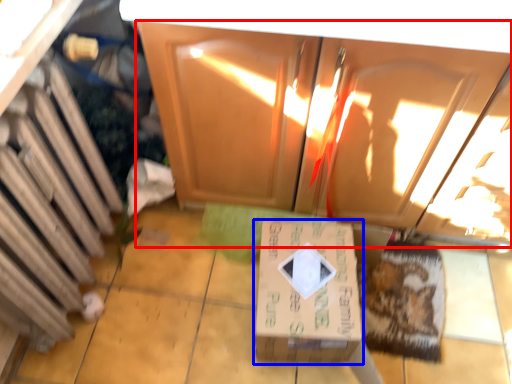
Question: Which object is closer to the camera taking this photo, cabinetry (highlighted by a red box) or box (highlighted by a blue box)?

Choices:
 (A) cabinetry
 (B) box

Answer: (A)